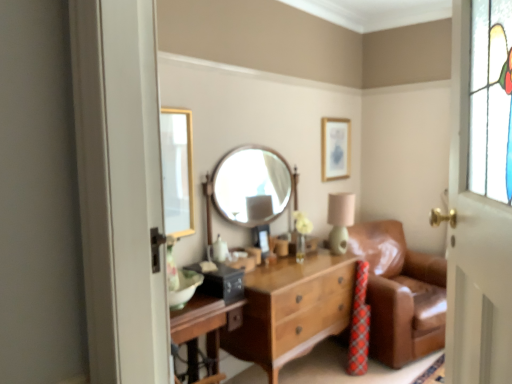
The width and height of the screenshot is (512, 384). What do you see at coordinates (401, 294) in the screenshot? I see `brown leather couch at right` at bounding box center [401, 294].

Locate an element on the screen. matte green table lamp at center is located at coordinates pyautogui.click(x=340, y=220).

What do you see at coordinates (340, 220) in the screenshot? The image size is (512, 384). I see `matte green table lamp at center` at bounding box center [340, 220].

At what (x,y) coordinates should I click in order to perform the action: click on wooden chest of drawers at center. Please return your answer as a coordinate pair (x, y). The image size is (512, 384). Looking at the image, I should click on (292, 309).

Measure the distance between wooden chest of drawers at center and camera.

The distance of wooden chest of drawers at center from camera is 2.41 meters.

Identify the location of brown leather couch at right. The width and height of the screenshot is (512, 384). click(401, 294).

Does gold metallic picture frame at upper center have a lesser height compared to matte green table lamp at center?

In fact, gold metallic picture frame at upper center may be taller than matte green table lamp at center.

Consider the image. From the image's perspective, relative to matte green table lamp at center, is gold metallic picture frame at upper center above or below?

Clearly, from the image's perspective, gold metallic picture frame at upper center is above matte green table lamp at center.

Do you think gold metallic picture frame at upper center is within matte green table lamp at center, or outside of it?

gold metallic picture frame at upper center exists outside the volume of matte green table lamp at center.

Which is closer, (350, 315) or (443, 328)?

The point (350, 315) is closer to the camera.

Looking at this image, who is taller, wooden chest of drawers at center or brown leather couch at right?

brown leather couch at right.

In the scene shown: From a real-world perspective, between wooden chest of drawers at center and brown leather couch at right, who is vertically lower?

wooden chest of drawers at center.

In terms of width, does wooden chest of drawers at center look wider or thinner when compared to brown leather couch at right?

wooden chest of drawers at center is thinner than brown leather couch at right.

Consider the image. Is brown leather couch at right inside gold metallic picture frame at upper center?

No, gold metallic picture frame at upper center does not contain brown leather couch at right.

Between gold metallic picture frame at upper center and brown leather couch at right, which one has less height?

With less height is gold metallic picture frame at upper center.

Measure the distance between gold metallic picture frame at upper center and brown leather couch at right.

gold metallic picture frame at upper center is 39.13 inches from brown leather couch at right.

Which is more to the right, gold metallic picture frame at upper center or brown leather couch at right?

From the viewer's perspective, brown leather couch at right appears more on the right side.

From a real-world perspective, is wooden chest of drawers at center on wooden round mirror at center?

No, from a real-world perspective, wooden chest of drawers at center is not above wooden round mirror at center.

Is point (334, 298) closer or farther from the camera than point (269, 174)?

Point (334, 298) is positioned closer to the camera compared to point (269, 174).

Who is bigger, wooden chest of drawers at center or wooden round mirror at center?

wooden chest of drawers at center.

Looking at this image, considering the relative positions of wooden chest of drawers at center and wooden round mirror at center in the image provided, is wooden chest of drawers at center to the left of wooden round mirror at center from the viewer's perspective?

Incorrect, wooden chest of drawers at center is not on the left side of wooden round mirror at center.

Does white painted wood door at right have a lesser width compared to wooden chest of drawers at center?

Yes.

Which of these two, white painted wood door at right or wooden chest of drawers at center, stands taller?

white painted wood door at right.

Which point is more distant from viewer, (467, 201) or (274, 367)?

The point (274, 367) is more distant.

Considering the sizes of brown leather couch at right and wooden chest of drawers at center in the image, is brown leather couch at right wider or thinner than wooden chest of drawers at center?

brown leather couch at right is wider than wooden chest of drawers at center.

Is brown leather couch at right shorter than wooden chest of drawers at center?

Incorrect, the height of brown leather couch at right does not fall short of that of wooden chest of drawers at center.

Can you tell me how much brown leather couch at right and wooden chest of drawers at center differ in facing direction?

brown leather couch at right and wooden chest of drawers at center are facing 17.2 degrees away from each other.

Is point (413, 342) positioned in front of point (292, 268)?

No, it is behind (292, 268).

Which is behind, wooden round mirror at center or white painted wood door at right?

wooden round mirror at center is more distant.

Does wooden round mirror at center appear on the left side of white painted wood door at right?

Indeed, wooden round mirror at center is positioned on the left side of white painted wood door at right.

From a real-world perspective, is wooden round mirror at center positioned over white painted wood door at right based on gravity?

No, from a real-world perspective, wooden round mirror at center is not over white painted wood door at right

From the image's perspective, relative to white painted wood door at right, is wooden round mirror at center above or below?

From the image's perspective, wooden round mirror at center appears above white painted wood door at right.

I want to click on table lamp in front of the gold metallic picture frame at upper center, so click(x=340, y=220).

The width and height of the screenshot is (512, 384). I want to click on the chest of drawers lying below the brown leather couch at right (from the image's perspective), so click(292, 309).

Which object lies nearer to the anchor point matte green table lamp at center, wooden chest of drawers at center or wooden round mirror at center?

Based on the image, wooden chest of drawers at center appears to be nearer to matte green table lamp at center.

From the image, which object appears to be farther from wooden round mirror at center, gold metallic picture frame at upper center or wooden chest of drawers at center?

gold metallic picture frame at upper center lies further to wooden round mirror at center than the other object.

Looking at the image, which one is located closer to wooden chest of drawers at center, white painted wood door at right or matte green table lamp at center?

The object closer to wooden chest of drawers at center is matte green table lamp at center.

When comparing their distances from white painted wood door at right, does wooden chest of drawers at center or wooden round mirror at center seem closer?

wooden chest of drawers at center.

When comparing their distances from wooden chest of drawers at center, does brown leather couch at right or wooden round mirror at center seem further?

wooden round mirror at center lies further to wooden chest of drawers at center than the other object.

Estimate the real-world distances between objects in this image. Which object is further from brown leather couch at right, matte green table lamp at center or gold metallic picture frame at upper center?

gold metallic picture frame at upper center is further to brown leather couch at right.

Based on their spatial positions, is wooden round mirror at center or white painted wood door at right further from brown leather couch at right?

white painted wood door at right.

From the image, which object appears to be farther from brown leather couch at right, wooden round mirror at center or matte green table lamp at center?

wooden round mirror at center is positioned further to the anchor brown leather couch at right.

Identify the location of table lamp between wooden round mirror at center and gold metallic picture frame at upper center along the z-axis. Image resolution: width=512 pixels, height=384 pixels. (340, 220).

Locate an element on the screen. The height and width of the screenshot is (384, 512). mirror positioned between white painted wood door at right and gold metallic picture frame at upper center from near to far is located at coordinates (251, 185).

Where is `table lamp between white painted wood door at right and gold metallic picture frame at upper center in the front-back direction`? table lamp between white painted wood door at right and gold metallic picture frame at upper center in the front-back direction is located at coordinates (340, 220).

The width and height of the screenshot is (512, 384). In order to click on chest of drawers between white painted wood door at right and matte green table lamp at center from front to back in this screenshot , I will do `click(292, 309)`.